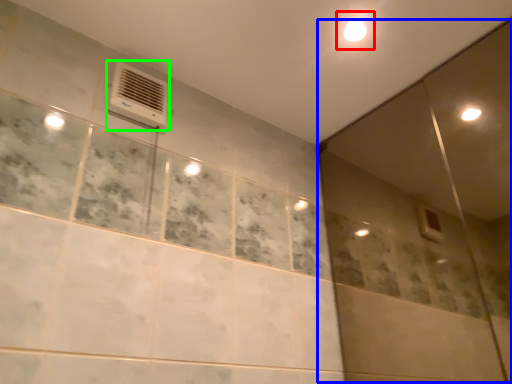
Question: Estimate the real-world distances between objects in this image. Which object is closer to light (highlighted by a red box), screen door (highlighted by a blue box) or air conditioning (highlighted by a green box)?

Choices:
 (A) screen door
 (B) air conditioning

Answer: (B)